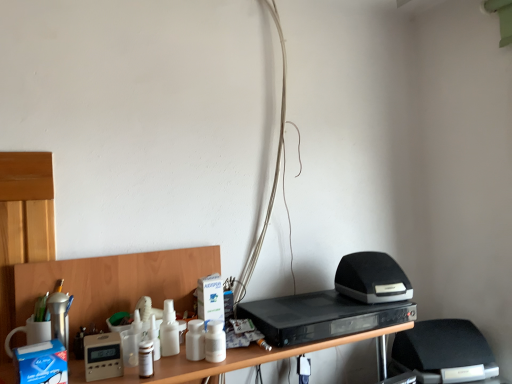
This screenshot has height=384, width=512. Find the location of `empty space that is ontop of black matte speaker at right, which is the second appliance from bottom to top (from a real-world perspective)`. empty space that is ontop of black matte speaker at right, which is the second appliance from bottom to top (from a real-world perspective) is located at coordinates (370, 257).